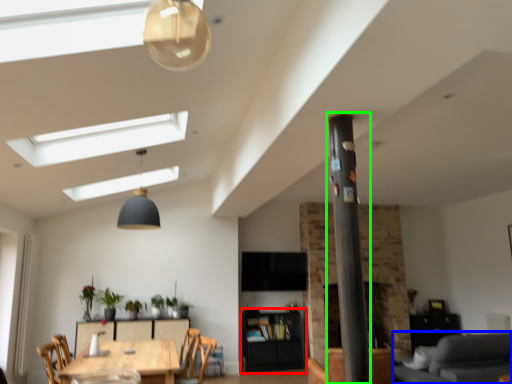
Question: Based on their relative distances, which object is nearer to cabinetry (highlighted by a red box)? Choose from couch (highlighted by a blue box) and pillar (highlighted by a green box).

Choices:
 (A) couch
 (B) pillar

Answer: (A)